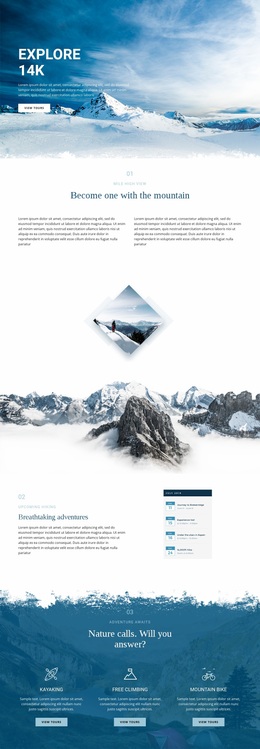
At what (x,y) coordinates should I click in order to perform the action: click on diamond shape picture. Please return your answer as a coordinate pair (x, y). Looking at the image, I should click on (129, 323).